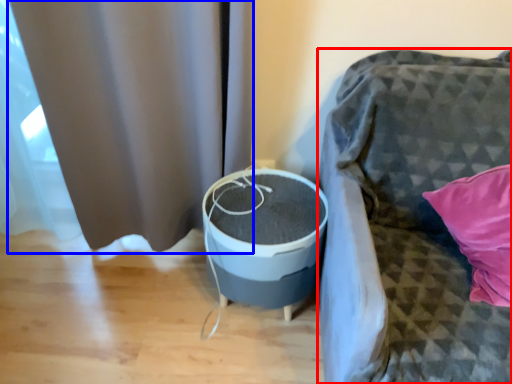
Question: Which of the following is the farthest to the observer, furniture (highlighted by a red box) or curtain (highlighted by a blue box)?

Choices:
 (A) furniture
 (B) curtain

Answer: (B)